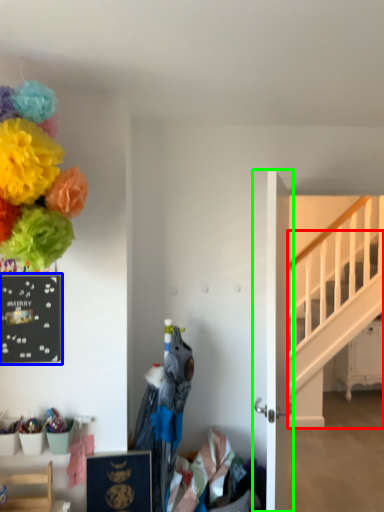
Question: Which object is the closest to the stairs (highlighted by a red box)? Choose among these: bulletin board (highlighted by a blue box) or door (highlighted by a green box).

Choices:
 (A) bulletin board
 (B) door

Answer: (B)